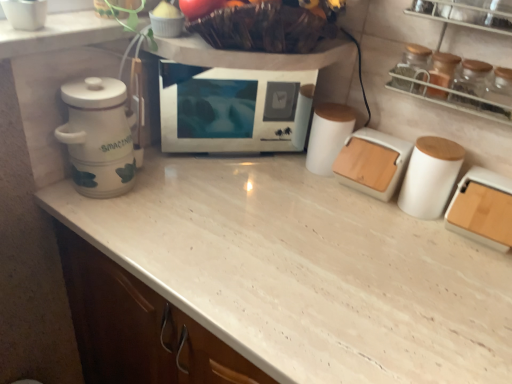
You are a GUI agent. You are given a task and a screenshot of the screen. Output one action in this format:
    pyautogui.click(x=<x>, y=<y>)
    Task: Click on the vacant space in front of white ceramic canister at left
    The image size is (512, 384).
    Given the screenshot: What is the action you would take?
    pyautogui.click(x=112, y=227)